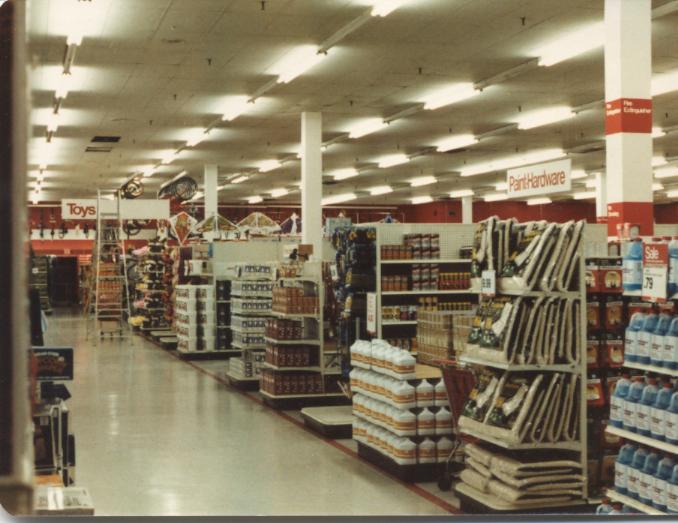
Locate an element on the screen. The image size is (678, 523). red stripe on the floor is located at coordinates (340, 448), (434, 501), (292, 420), (255, 401), (196, 373).